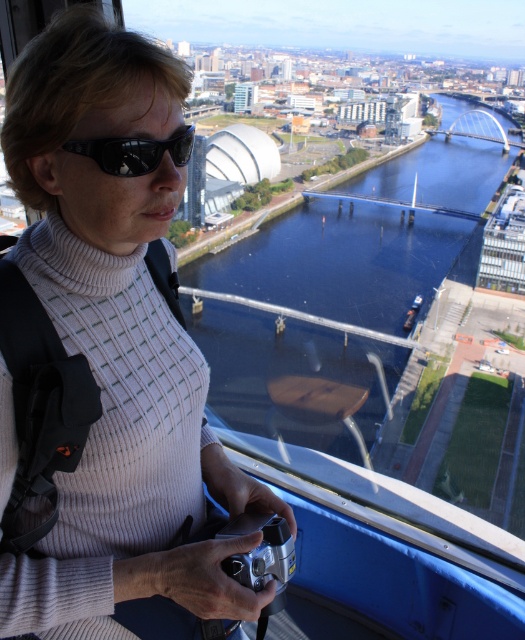
Looking at this image, is white ribbed sweater at upper left taller than black reflective sunglasses at upper center?

Yes.

Locate an element on the screen. The width and height of the screenshot is (525, 640). white ribbed sweater at upper left is located at coordinates (107, 365).

Is blue glassy river at center taller than black reflective sunglasses at upper center?

Yes.

Looking at this image, between blue glassy river at center and black reflective sunglasses at upper center, which one appears on the right side from the viewer's perspective?

blue glassy river at center is more to the right.

Is point (259, 387) closer to camera compared to point (98, 148)?

No, it is behind (98, 148).

The width and height of the screenshot is (525, 640). Find the location of `blue glassy river at center`. blue glassy river at center is located at coordinates (365, 241).

Does blue glassy river at center appear under silver metallic camera at lower center?

Incorrect, blue glassy river at center is not positioned below silver metallic camera at lower center.

Does blue glassy river at center have a greater height compared to silver metallic camera at lower center?

Yes, blue glassy river at center is taller than silver metallic camera at lower center.

Is point (474, 272) closer to camera compared to point (286, 579)?

No, it is not.

Where is `blue glassy river at center`? blue glassy river at center is located at coordinates (365, 241).